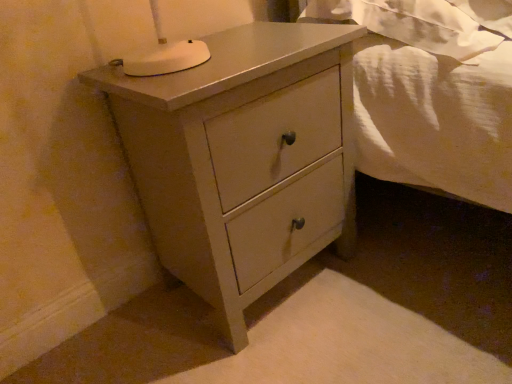
This screenshot has width=512, height=384. Identify the location of matte gray chest of drawers at center. (242, 158).

The width and height of the screenshot is (512, 384). Describe the element at coordinates (242, 158) in the screenshot. I see `matte gray chest of drawers at center` at that location.

Measure the distance between point (185,163) and camera.

A distance of 31.18 inches exists between point (185,163) and camera.

What is the approximate width of matte gray chest of drawers at center?

matte gray chest of drawers at center is 16.71 inches wide.

The height and width of the screenshot is (384, 512). I want to click on white cotton sheet at upper right, so click(x=425, y=22).

Describe the element at coordinates (425, 22) in the screenshot. This screenshot has height=384, width=512. I see `white cotton sheet at upper right` at that location.

You are a GUI agent. You are given a task and a screenshot of the screen. Output one action in this format:
    pyautogui.click(x=<x>, y=<y>)
    Task: Click on the matte gray chest of drawers at center
    The height and width of the screenshot is (384, 512).
    Given the screenshot: What is the action you would take?
    pyautogui.click(x=242, y=158)

Does matte gray chest of drawers at center appear on the left side of white cotton sheet at upper right?

Yes, matte gray chest of drawers at center is to the left of white cotton sheet at upper right.

Considering the positions of objects matte gray chest of drawers at center and white cotton sheet at upper right in the image provided, who is in front, matte gray chest of drawers at center or white cotton sheet at upper right?

matte gray chest of drawers at center is more forward.

Between point (241, 283) and point (432, 38), which one is positioned behind?

Point (432, 38)

From the image's perspective, is matte gray chest of drawers at center above or below white cotton sheet at upper right?

Based on their image positions, matte gray chest of drawers at center is located beneath white cotton sheet at upper right.

From a real-world perspective, which is physically above, matte gray chest of drawers at center or white cotton sheet at upper right?

white cotton sheet at upper right is physically above.

Which object is wider, matte gray chest of drawers at center or white cotton sheet at upper right?

Wider between the two is white cotton sheet at upper right.

Looking at this image, can you confirm if matte gray chest of drawers at center is taller than white cotton sheet at upper right?

Yes, matte gray chest of drawers at center is taller than white cotton sheet at upper right.

Which of these two, matte gray chest of drawers at center or white cotton sheet at upper right, is bigger?

With larger size is matte gray chest of drawers at center.

Is matte gray chest of drawers at center surrounding white cotton sheet at upper right?

No, white cotton sheet at upper right is not surrounded by matte gray chest of drawers at center.

Is there a large distance between matte gray chest of drawers at center and white cotton sheet at upper right?

No, matte gray chest of drawers at center is not far away from white cotton sheet at upper right.

Could you tell me if matte gray chest of drawers at center is turned towards white cotton sheet at upper right?

No, matte gray chest of drawers at center is not aimed at white cotton sheet at upper right.

Identify the location of chest of drawers to the left of white cotton sheet at upper right. (242, 158).

Does white cotton sheet at upper right appear on the right side of matte gray chest of drawers at center?

Yes.

Which object is further away from the camera, white cotton sheet at upper right or matte gray chest of drawers at center?

Positioned behind is white cotton sheet at upper right.

Is point (470, 46) farther from camera compared to point (336, 203)?

That is False.

From the image's perspective, is white cotton sheet at upper right located beneath matte gray chest of drawers at center?

Incorrect, from the image's perspective, white cotton sheet at upper right is higher than matte gray chest of drawers at center.

From the picture: From a real-world perspective, is white cotton sheet at upper right physically below matte gray chest of drawers at center?

Actually, white cotton sheet at upper right is physically above matte gray chest of drawers at center in the real world.

Does white cotton sheet at upper right have a greater width compared to matte gray chest of drawers at center?

Yes, white cotton sheet at upper right is wider than matte gray chest of drawers at center.

Can you confirm if white cotton sheet at upper right is shorter than matte gray chest of drawers at center?

Yes, white cotton sheet at upper right is shorter than matte gray chest of drawers at center.

Based on their sizes in the image, would you say white cotton sheet at upper right is bigger or smaller than matte gray chest of drawers at center?

Considering their sizes, white cotton sheet at upper right takes up less space than matte gray chest of drawers at center.

Can matte gray chest of drawers at center be found inside white cotton sheet at upper right?

Answer: No, matte gray chest of drawers at center is not inside white cotton sheet at upper right.

From the picture: Would you say white cotton sheet at upper right is a long distance from matte gray chest of drawers at center?

No.

Could you tell me if white cotton sheet at upper right is facing matte gray chest of drawers at center?

No, white cotton sheet at upper right is not facing towards matte gray chest of drawers at center.

Where is `chest of drawers on the left of white cotton sheet at upper right`? chest of drawers on the left of white cotton sheet at upper right is located at coordinates (242, 158).

What are the coordinates of `chest of drawers on the left of the white cotton sheet at upper right` in the screenshot? It's located at (242, 158).

You are a GUI agent. You are given a task and a screenshot of the screen. Output one action in this format:
    pyautogui.click(x=<x>, y=<y>)
    Task: Click on the sheet that is on the right side of matte gray chest of drawers at center
    The image size is (512, 384).
    Given the screenshot: What is the action you would take?
    pyautogui.click(x=425, y=22)